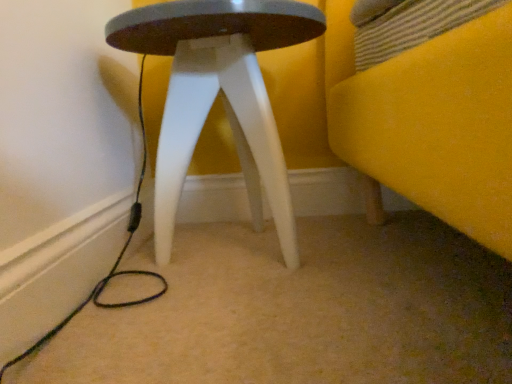
Question: Would you say matte white stool at center contains black cable at lower left?

Choices:
 (A) yes
 (B) no

Answer: (B)

Question: Is matte white stool at center positioned far away from black cable at lower left?

Choices:
 (A) yes
 (B) no

Answer: (B)

Question: Is matte white stool at center thinner than black cable at lower left?

Choices:
 (A) no
 (B) yes

Answer: (A)

Question: Is the depth of matte white stool at center greater than that of black cable at lower left?

Choices:
 (A) no
 (B) yes

Answer: (B)

Question: Is matte white stool at center closer to camera compared to black cable at lower left?

Choices:
 (A) yes
 (B) no

Answer: (B)

Question: Is matte white stool at center smaller than black cable at lower left?

Choices:
 (A) no
 (B) yes

Answer: (A)

Question: From a real-world perspective, does black cable at lower left sit lower than matte white stool at center?

Choices:
 (A) yes
 (B) no

Answer: (A)

Question: Considering the relative positions of black cable at lower left and matte white stool at center in the image provided, is black cable at lower left to the left of matte white stool at center from the viewer's perspective?

Choices:
 (A) yes
 (B) no

Answer: (A)

Question: Is black cable at lower left located outside matte white stool at center?

Choices:
 (A) no
 (B) yes

Answer: (B)

Question: From the image's perspective, is black cable at lower left beneath matte white stool at center?

Choices:
 (A) no
 (B) yes

Answer: (B)

Question: Is black cable at lower left aimed at matte white stool at center?

Choices:
 (A) yes
 (B) no

Answer: (A)

Question: From a real-world perspective, is black cable at lower left over matte white stool at center?

Choices:
 (A) no
 (B) yes

Answer: (A)

Question: Relative to black cable at lower left, is matte white stool at center in front or behind?

Choices:
 (A) behind
 (B) front

Answer: (A)